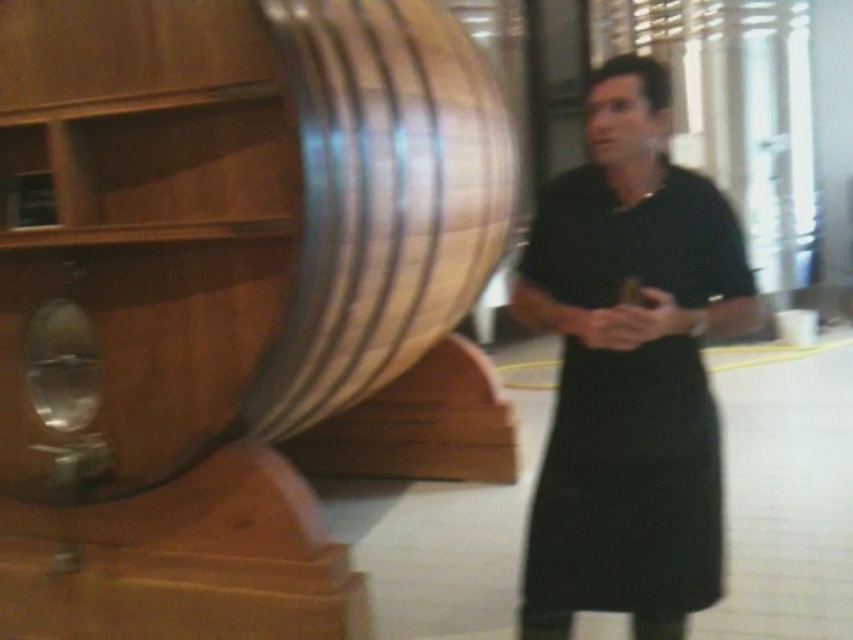
Who is higher up, wooden barrel at center or black matte apron at center?

Positioned higher is wooden barrel at center.

Describe the element at coordinates (228, 221) in the screenshot. I see `wooden barrel at center` at that location.

Describe the element at coordinates (228, 221) in the screenshot. This screenshot has height=640, width=853. I see `wooden barrel at center` at that location.

Find the location of `wooden barrel at center`. wooden barrel at center is located at coordinates (228, 221).